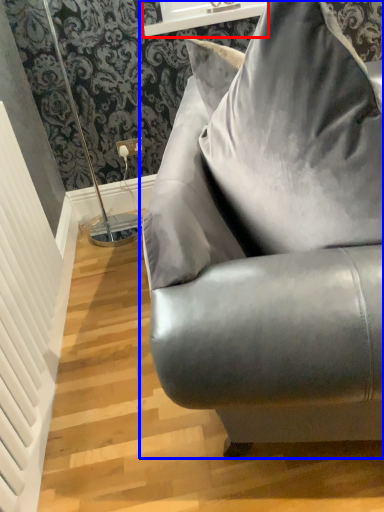
Question: Which object appears farthest to the camera in this image, window sill (highlighted by a red box) or studio couch (highlighted by a blue box)?

Choices:
 (A) window sill
 (B) studio couch

Answer: (A)